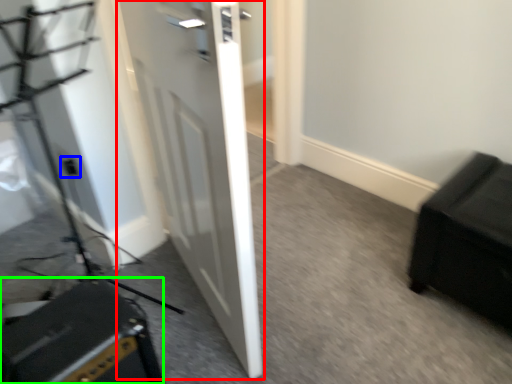
Question: Based on their relative distances, which object is farther from door (highlighted by a red box)? Choose from electric outlet (highlighted by a blue box) and speaker (highlighted by a green box).

Choices:
 (A) electric outlet
 (B) speaker

Answer: (A)